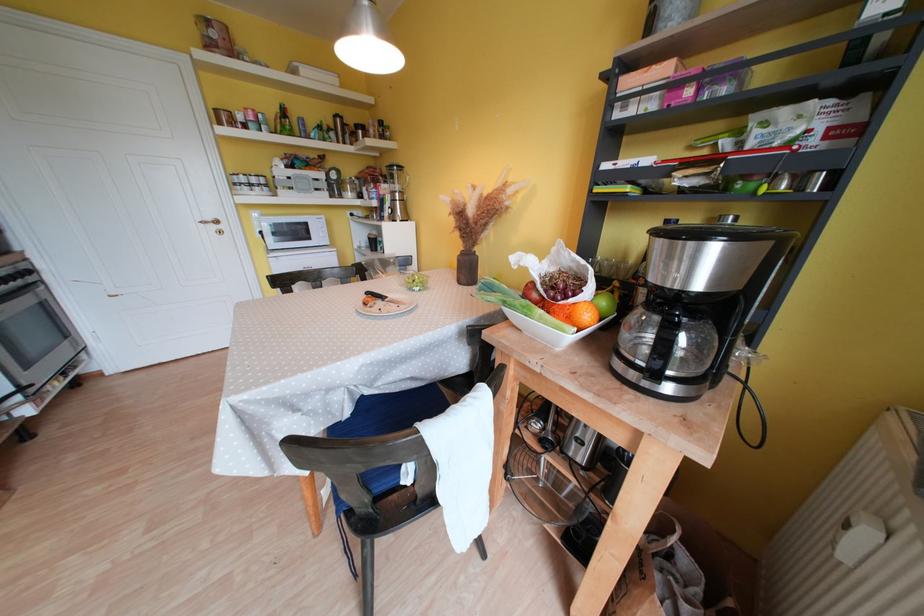
You are a GUI agent. You are given a task and a screenshot of the screen. Output one action in this format:
    pyautogui.click(x=<x>, y=<y>)
    Task: Click on the glass coffee pot
    Image resolution: width=924 pixels, height=616 pixels.
    Given the screenshot: What is the action you would take?
    pyautogui.click(x=695, y=305)